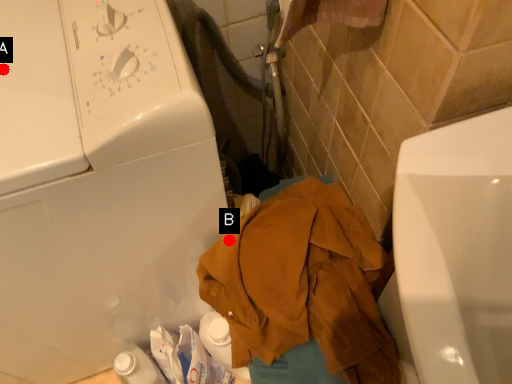
Question: Two points are circled on the image, labeled by A and B beside each circle. Which point is closer to the camera?

Choices:
 (A) A is closer
 (B) B is closer

Answer: (A)